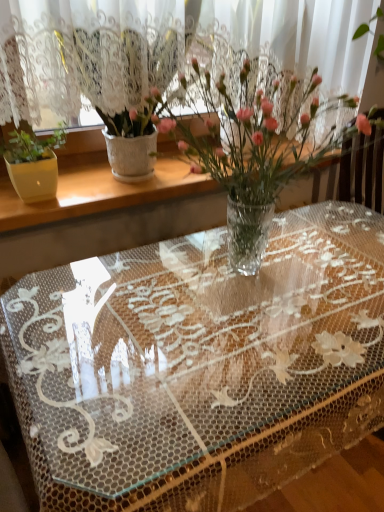
Locate an element on the screen. The width and height of the screenshot is (384, 512). vacant space that is to the left of clear plastic vase at center, the 2th houseplant viewed from the left is located at coordinates (77, 309).